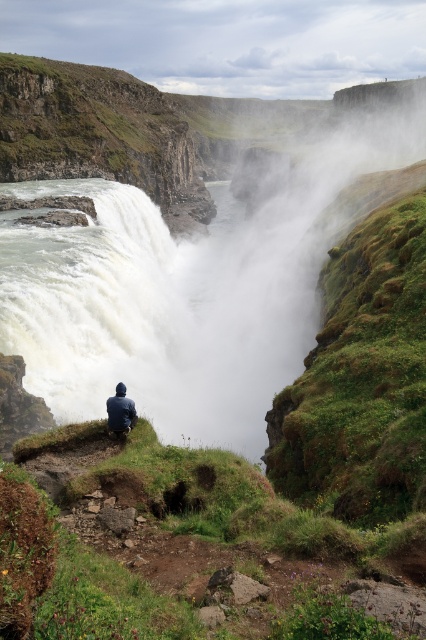
Question: Which object appears closest to the camera in this image?

Choices:
 (A) white mist at center
 (B) dark blue jacket at center

Answer: (B)

Question: Is white mist at center to the right of dark blue jacket at center from the viewer's perspective?

Choices:
 (A) no
 (B) yes

Answer: (B)

Question: Is white mist at center closer to camera compared to dark blue jacket at center?

Choices:
 (A) yes
 (B) no

Answer: (B)

Question: Is white mist at center positioned in front of dark blue jacket at center?

Choices:
 (A) no
 (B) yes

Answer: (A)